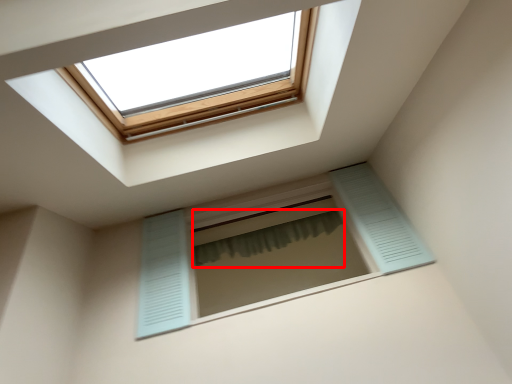
Question: From the image, what is the correct spatial relationship of shower curtain (annotated by the red box) in relation to window?

Choices:
 (A) right
 (B) left

Answer: (A)